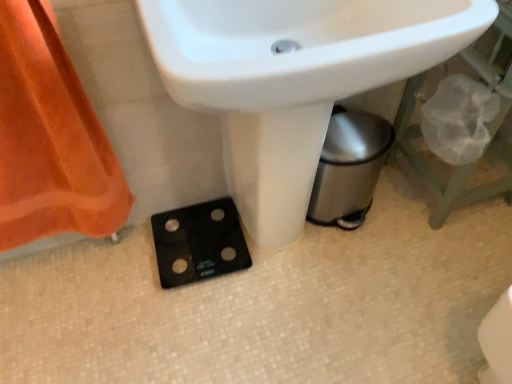
Question: Is white glossy sink at center a part of black glass scale at lower center?

Choices:
 (A) no
 (B) yes

Answer: (A)

Question: From the image's perspective, is black glass scale at lower center beneath white glossy sink at center?

Choices:
 (A) yes
 (B) no

Answer: (A)

Question: From a real-world perspective, is black glass scale at lower center physically above white glossy sink at center?

Choices:
 (A) yes
 (B) no

Answer: (B)

Question: Would you say black glass scale at lower center is a long distance from white glossy sink at center?

Choices:
 (A) no
 (B) yes

Answer: (A)

Question: Is black glass scale at lower center smaller than white glossy sink at center?

Choices:
 (A) yes
 (B) no

Answer: (A)

Question: Is black glass scale at lower center taller than white glossy sink at center?

Choices:
 (A) yes
 (B) no

Answer: (B)

Question: Is white glossy sink at center shorter than black glass scale at lower center?

Choices:
 (A) yes
 (B) no

Answer: (B)

Question: Is white glossy sink at center taller than black glass scale at lower center?

Choices:
 (A) yes
 (B) no

Answer: (A)

Question: Is black glass scale at lower center surrounded by white glossy sink at center?

Choices:
 (A) no
 (B) yes

Answer: (A)

Question: Does white glossy sink at center come behind black glass scale at lower center?

Choices:
 (A) yes
 (B) no

Answer: (B)

Question: Is white glossy sink at center touching black glass scale at lower center?

Choices:
 (A) yes
 (B) no

Answer: (B)

Question: Considering the relative sizes of white glossy sink at center and black glass scale at lower center in the image provided, is white glossy sink at center wider than black glass scale at lower center?

Choices:
 (A) yes
 (B) no

Answer: (A)

Question: Considering the relative sizes of black glass scale at lower center and orange fabric at left in the image provided, is black glass scale at lower center smaller than orange fabric at left?

Choices:
 (A) yes
 (B) no

Answer: (A)